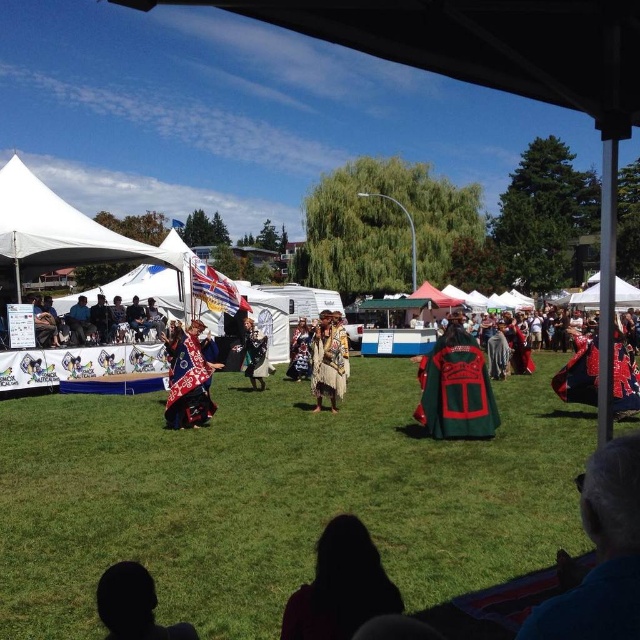
Which of these two, gray fabric at lower right or patterned fabric dress at center, stands taller?

patterned fabric dress at center is taller.

Is gray fabric at lower right to the left of patterned fabric dress at center from the viewer's perspective?

No, gray fabric at lower right is not to the left of patterned fabric dress at center.

Image resolution: width=640 pixels, height=640 pixels. What do you see at coordinates (602, 554) in the screenshot?
I see `gray fabric at lower right` at bounding box center [602, 554].

This screenshot has width=640, height=640. I want to click on gray fabric at lower right, so pyautogui.click(x=602, y=554).

Is the position of green fabric cape at center more distant than that of patterned fabric dress at center?

No, it is not.

Which is in front, point (259, 380) or point (304, 346)?

Point (259, 380)

In order to click on green fabric cape at center in this screenshot , I will do `click(256, 355)`.

Does textured brown fur coat at center appear over patterned fabric dress at center?

Indeed, textured brown fur coat at center is positioned over patterned fabric dress at center.

Does textured brown fur coat at center appear on the right side of patterned fabric dress at center?

Yes, textured brown fur coat at center is to the right of patterned fabric dress at center.

Measure the distance between textured brown fur coat at center and camera.

textured brown fur coat at center and camera are 37.84 feet apart from each other.

Locate an element on the screen. textured brown fur coat at center is located at coordinates (330, 358).